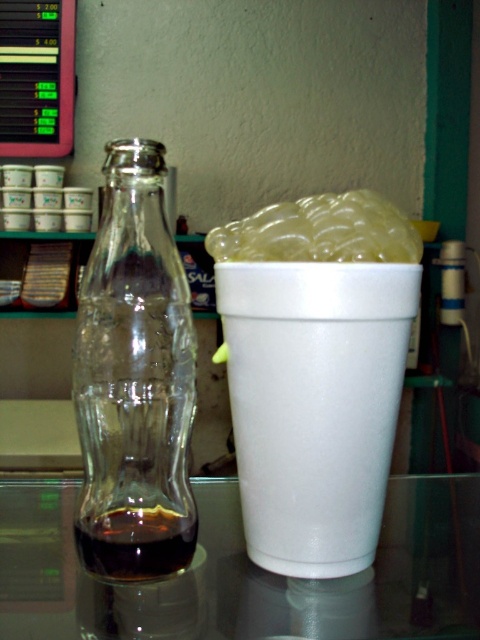
You are standing in front of the glass Coca Cola bottle and styrofoam cup on the reflective surface. You need to place a small sticker on the point that is closer to you. Which point should you choose between point (96, 401) and point (168, 518)?

Point (96, 401) is closer to the viewer than point (168, 518), so you should place the sticker on point (96, 401).

You are standing at the origin point of the coordinate system. You want to place a new object at the position of the transparent glass table at center. What are the coordinates you should input into the system?

Result: The coordinates you should input into the system are (244, 573).